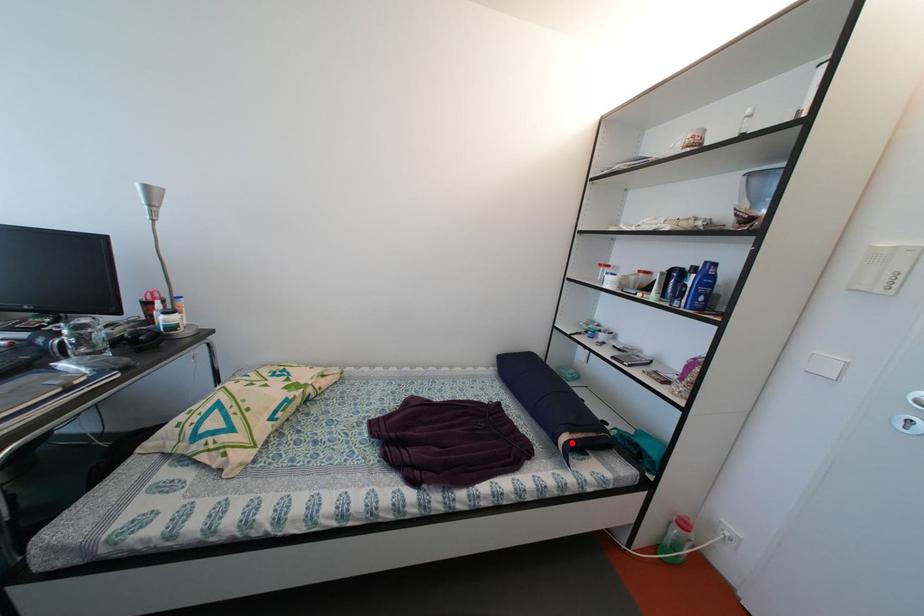
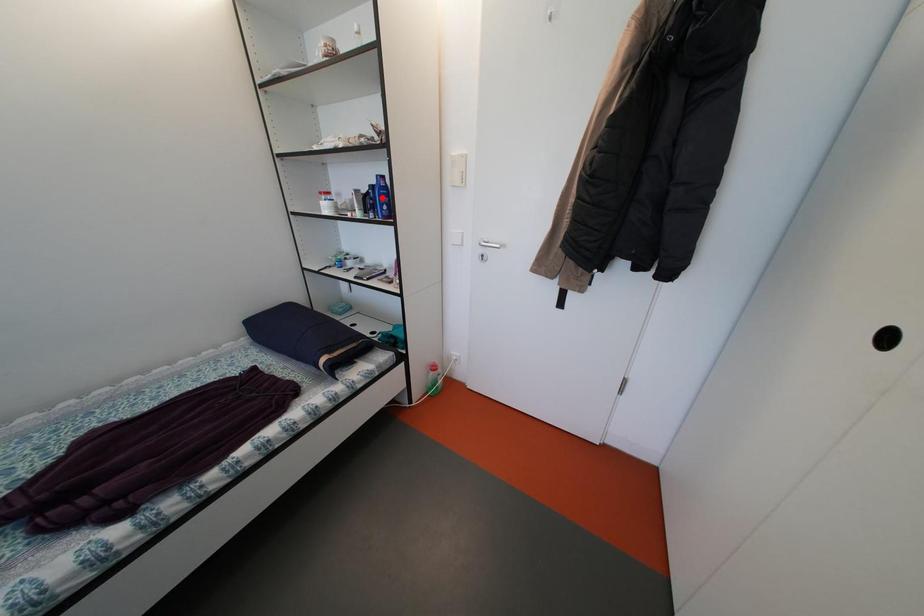
I am providing you with two images of the same scene from different viewpoints. A red point is marked on the first image and another point is marked on the second image. Is the marked point in image1 the same physical position as the marked point in image2?

No